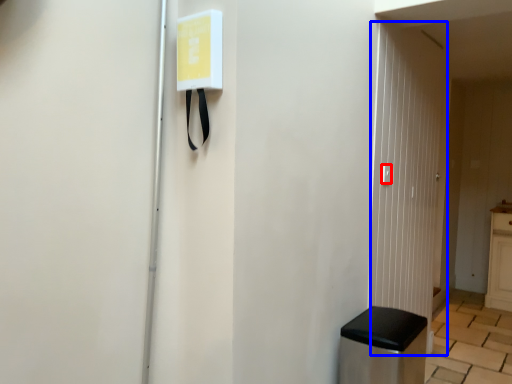
Question: Which object is further to the camera taking this photo, light switch (highlighted by a red box) or glass door (highlighted by a blue box)?

Choices:
 (A) light switch
 (B) glass door

Answer: (A)